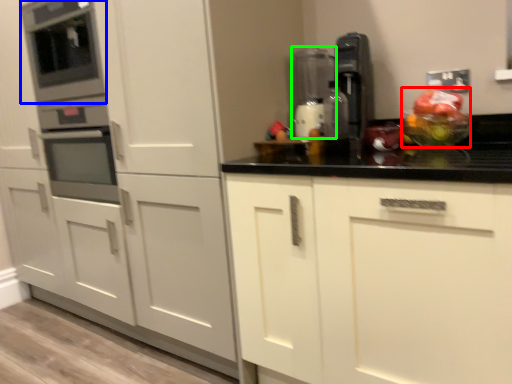
Question: Estimate the real-world distances between objects in this image. Which object is farther from fruit salad (highlighted by a red box), appliance (highlighted by a blue box) or appliance (highlighted by a green box)?

Choices:
 (A) appliance
 (B) appliance

Answer: (A)